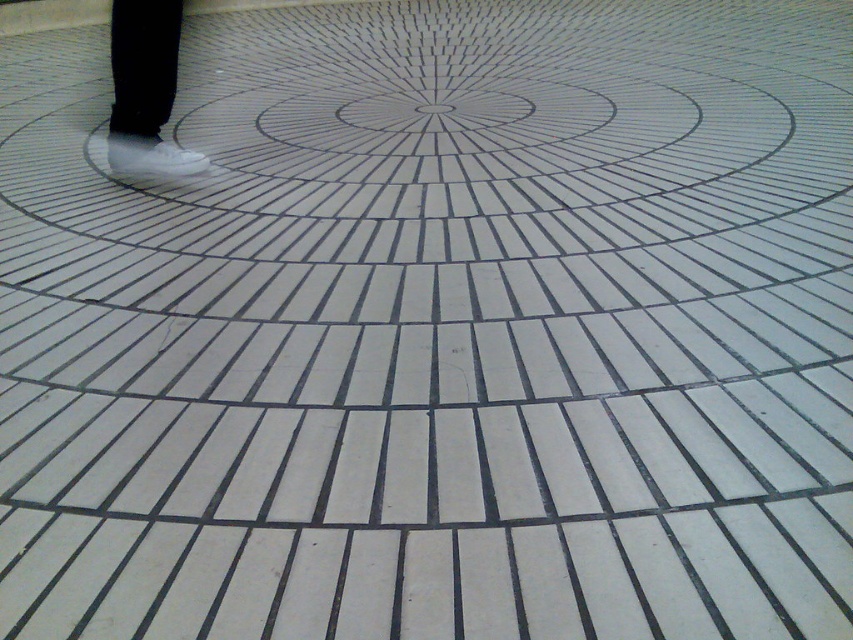
Is white matte shoe at center taller than white matte shoe at left?

Yes, white matte shoe at center is taller than white matte shoe at left.

Does white matte shoe at center appear under white matte shoe at left?

No.

I want to click on white matte shoe at center, so click(144, 90).

Identify the location of white matte shoe at center. (144, 90).